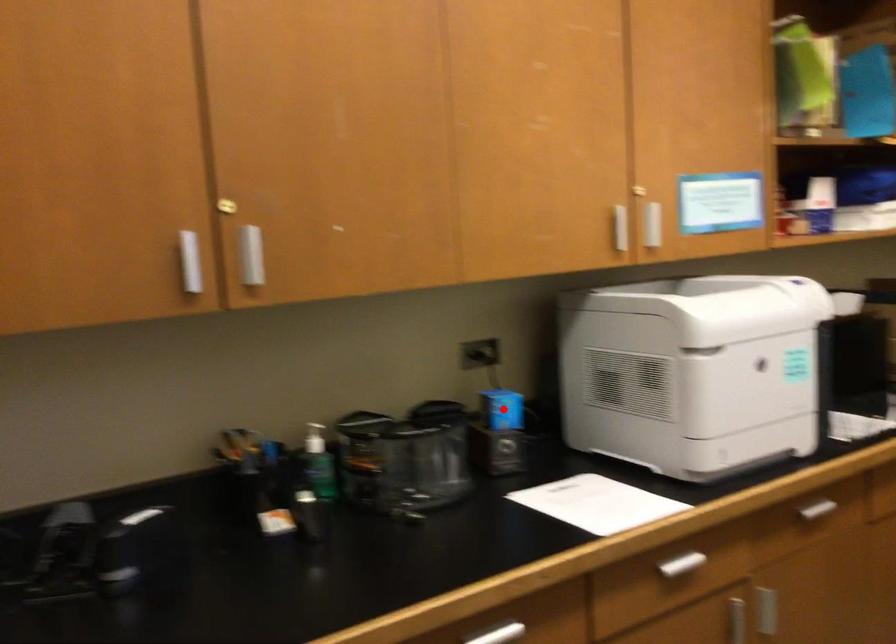
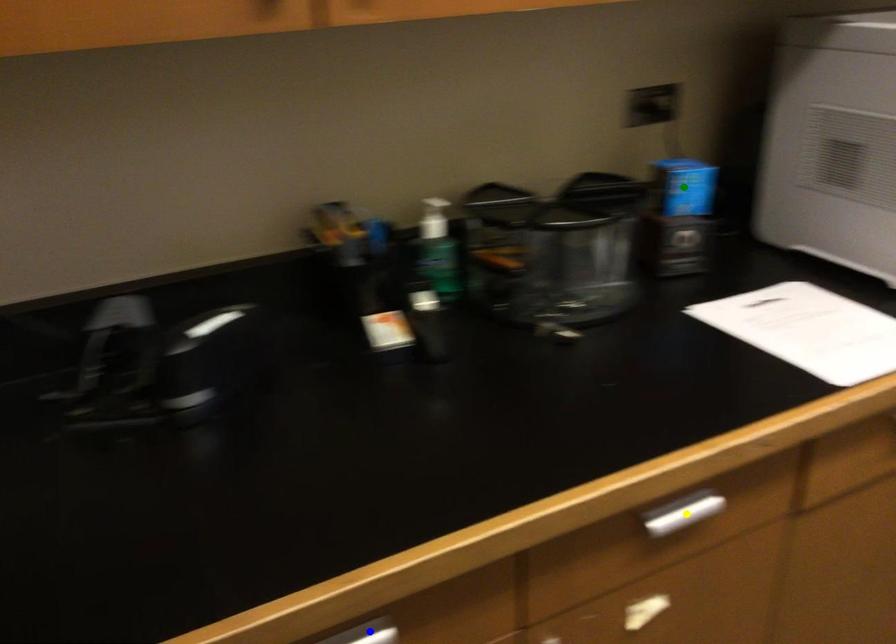
Question: I am providing you with two images of the same scene from different viewpoints. A red point is marked on the first image. You are given multiple points on the second image. In image 2, which mark is for the same physical point as the one in image 1?

Choices:
 (A) green point
 (B) blue point
 (C) yellow point

Answer: (A)